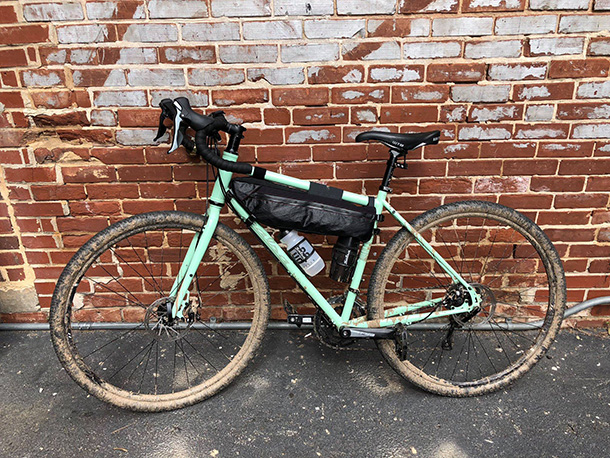
This screenshot has width=610, height=458. Find the location of `seat height`. seat height is located at coordinates (381, 187), (395, 149).